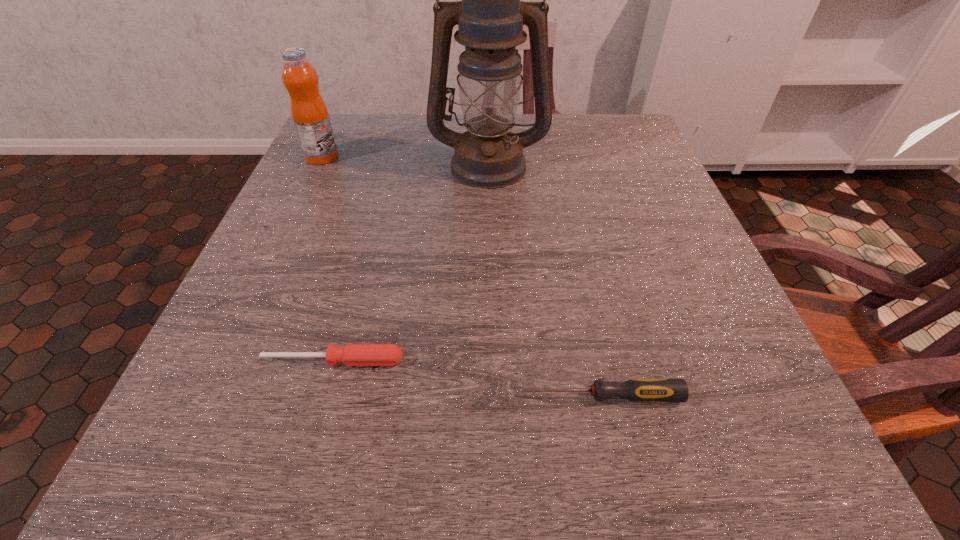
This screenshot has width=960, height=540. What are the coordinates of `vacant space located insert the nearest object into a screw head` in the screenshot? It's located at (252, 396).

This screenshot has height=540, width=960. Identify the location of vacant area situated insert the nearest object into a screw head. (274, 396).

Find the location of a particular element. Image resolution: width=960 pixels, height=540 pixels. vacant space situated 0.330m on the back of the left screwdriver is located at coordinates (373, 213).

This screenshot has width=960, height=540. In order to click on oil lamp situated at the far edge in this screenshot , I will do `click(490, 18)`.

Find the location of a particular element. Image resolution: width=960 pixels, height=540 pixels. fruit juice present at the far edge is located at coordinates click(x=309, y=111).

Locate an element on the screen. The height and width of the screenshot is (540, 960). fruit juice located in the left edge section of the desktop is located at coordinates (309, 111).

Identify the location of screwdriver present at the left edge. Image resolution: width=960 pixels, height=540 pixels. (352, 354).

Image resolution: width=960 pixels, height=540 pixels. I want to click on object situated at the right edge, so click(x=640, y=390).

At what (x,y) coordinates should I click in order to perform the action: click on object that is positioned at the far left corner. Please return your answer as a coordinate pair (x, y). Looking at the image, I should click on (309, 111).

The width and height of the screenshot is (960, 540). Identify the location of free region at the far edge. (402, 148).